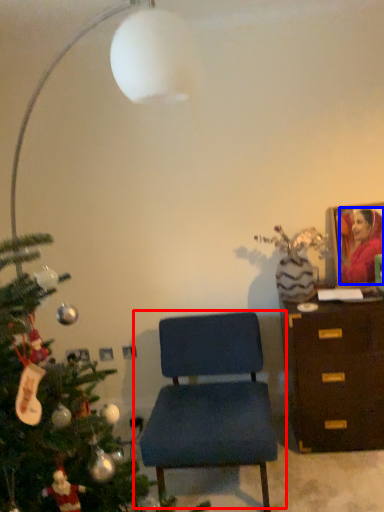
Question: Among these objects, which one is farthest to the camera, chair (highlighted by a red box) or person (highlighted by a blue box)?

Choices:
 (A) chair
 (B) person

Answer: (B)